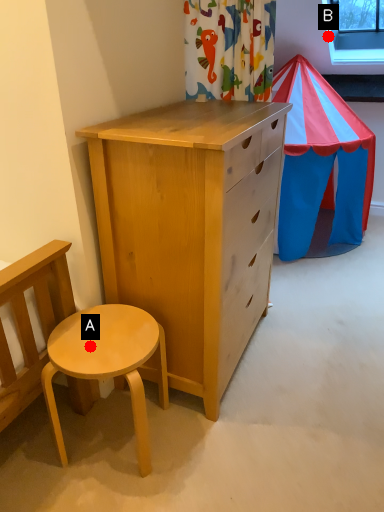
Question: Two points are circled on the image, labeled by A and B beside each circle. Which point appears closest to the camera in this image?

Choices:
 (A) A is closer
 (B) B is closer

Answer: (A)